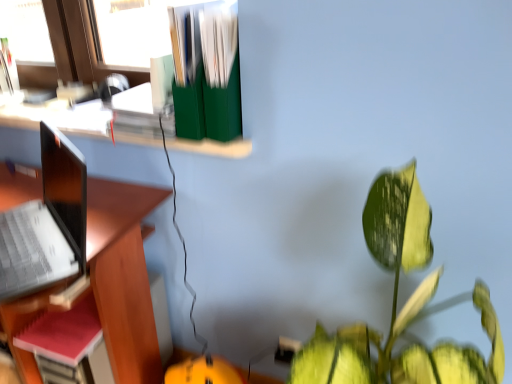
Question: Considering the relative positions of red matte notebook at left and green matte file folders at upper center in the image provided, is red matte notebook at left behind green matte file folders at upper center?

Choices:
 (A) yes
 (B) no

Answer: (A)

Question: Can we say red matte notebook at left lies outside green matte file folders at upper center?

Choices:
 (A) no
 (B) yes

Answer: (B)

Question: Is red matte notebook at left wider than green matte file folders at upper center?

Choices:
 (A) no
 (B) yes

Answer: (A)

Question: Can you confirm if red matte notebook at left is positioned to the right of green matte file folders at upper center?

Choices:
 (A) yes
 (B) no

Answer: (B)

Question: Is red matte notebook at left facing away from green matte file folders at upper center?

Choices:
 (A) no
 (B) yes

Answer: (A)

Question: From the image's perspective, is red matte notebook at left located beneath green matte file folders at upper center?

Choices:
 (A) yes
 (B) no

Answer: (A)

Question: From a real-world perspective, is red matte notebook at left on green matte file organizer at upper center?

Choices:
 (A) yes
 (B) no

Answer: (B)

Question: Is red matte notebook at left looking in the opposite direction of green matte file organizer at upper center?

Choices:
 (A) yes
 (B) no

Answer: (B)

Question: Does red matte notebook at left have a larger size compared to green matte file organizer at upper center?

Choices:
 (A) yes
 (B) no

Answer: (B)

Question: Can you confirm if red matte notebook at left is positioned to the left of green matte file organizer at upper center?

Choices:
 (A) no
 (B) yes

Answer: (B)

Question: Could you tell me if red matte notebook at left is facing green matte file organizer at upper center?

Choices:
 (A) no
 (B) yes

Answer: (A)

Question: Are red matte notebook at left and green matte file organizer at upper center far apart?

Choices:
 (A) yes
 (B) no

Answer: (B)

Question: Is green matte file folders at upper center oriented towards green matte file organizer at upper center?

Choices:
 (A) yes
 (B) no

Answer: (B)